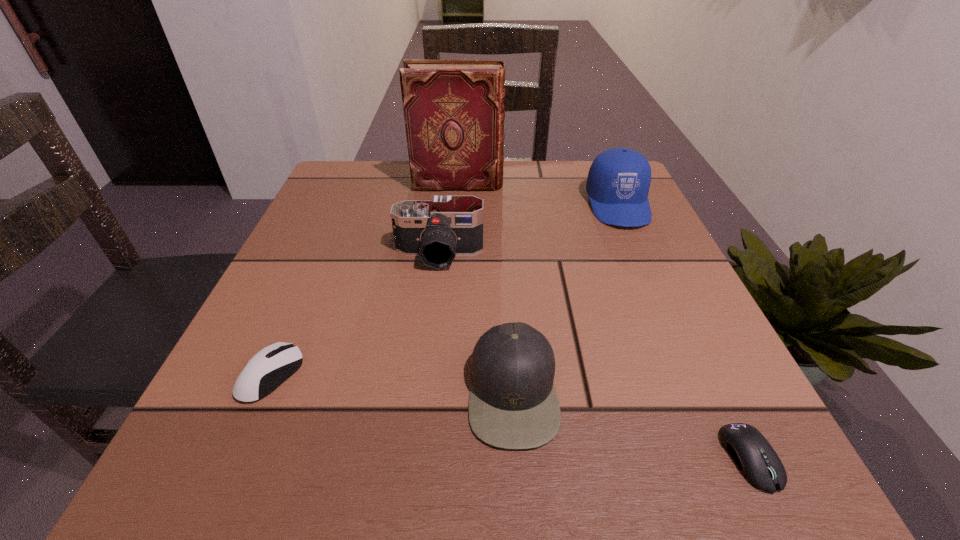
Find the location of `cap that is at the near edge`. cap that is at the near edge is located at coordinates (513, 404).

Locate an element on the screen. computer equipment that is at the near edge is located at coordinates (758, 462).

In order to click on object present at the left edge in this screenshot , I will do `click(271, 366)`.

Where is `cap that is at the right edge`? cap that is at the right edge is located at coordinates (618, 182).

In order to click on computer equipment positioned at the right edge in this screenshot , I will do `click(758, 462)`.

At what (x,y) coordinates should I click in order to perform the action: click on object positioned at the far right corner. Please return your answer as a coordinate pair (x, y). This screenshot has width=960, height=540. Looking at the image, I should click on pyautogui.click(x=618, y=182).

The height and width of the screenshot is (540, 960). What are the coordinates of `object positioned at the near right corner` in the screenshot? It's located at point(758,462).

You are a GUI agent. You are given a task and a screenshot of the screen. Output one action in this format:
    pyautogui.click(x=<x>, y=<y>)
    Task: Click on the vacant area at the far edge
    The width and height of the screenshot is (960, 540).
    Given the screenshot: What is the action you would take?
    pyautogui.click(x=540, y=186)

Locate an element on the screen. This screenshot has height=540, width=960. vacant space at the near edge of the desktop is located at coordinates (353, 483).

The height and width of the screenshot is (540, 960). In order to click on free location at the left edge in this screenshot , I will do `click(304, 221)`.